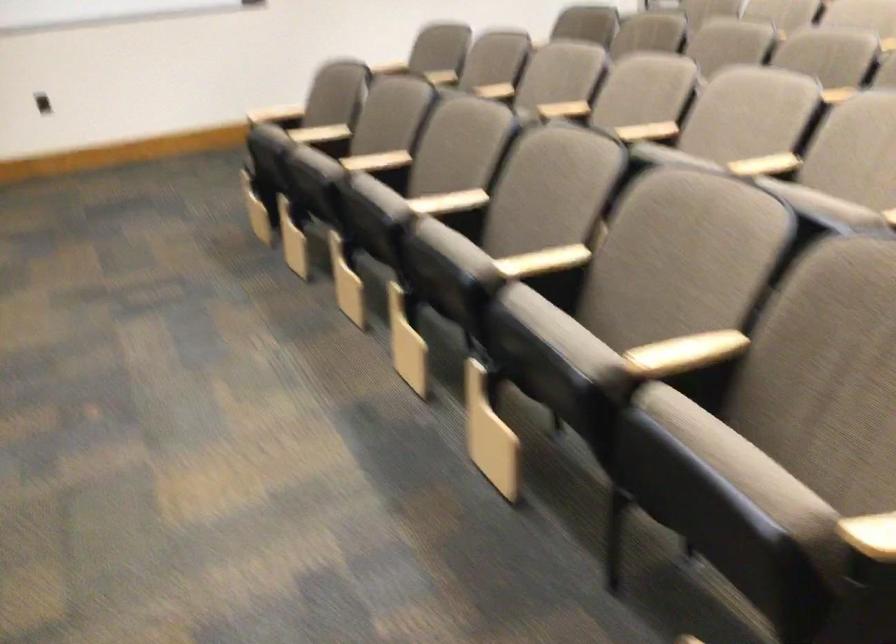
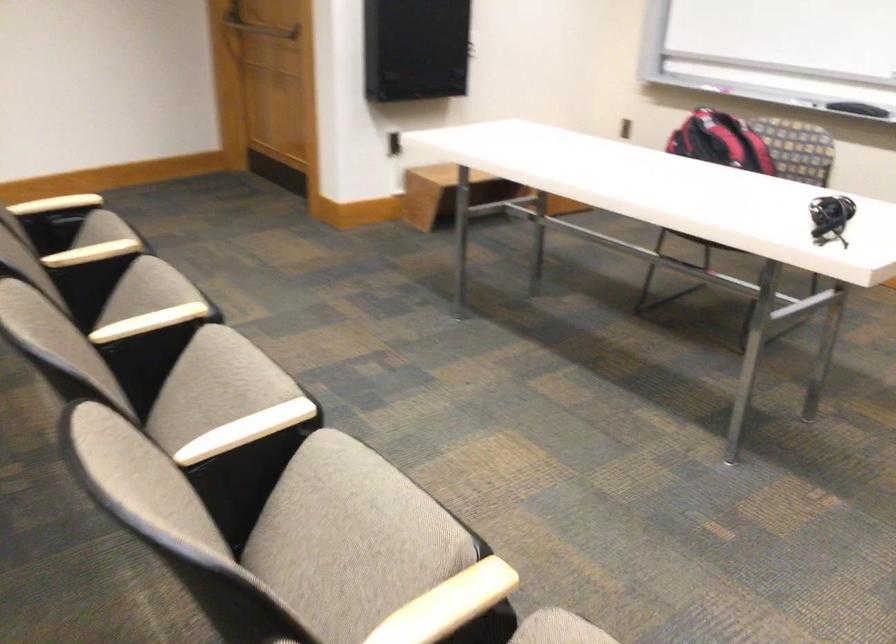
Find the pixel in the second image that matches (x=457, y=250) in the first image.

(214, 386)